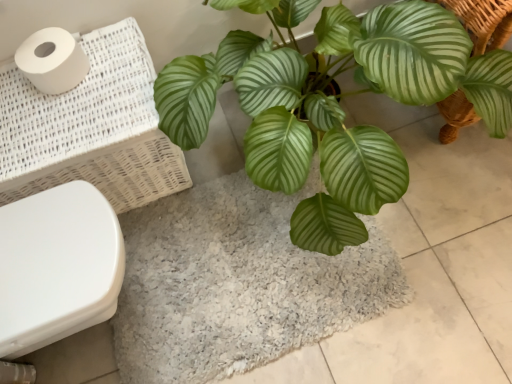
This screenshot has width=512, height=384. I want to click on vacant space that is to the left of white matte toilet paper at upper left, so click(12, 93).